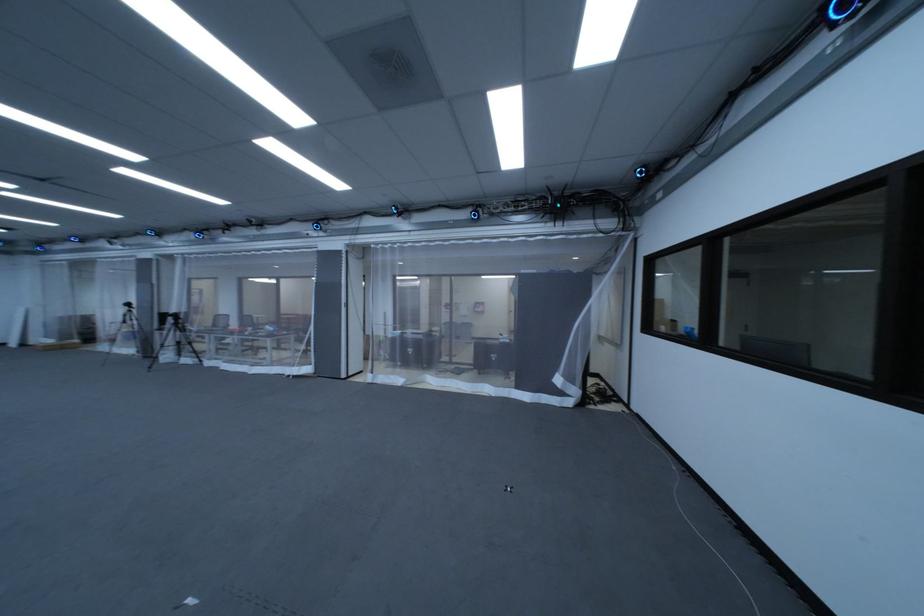
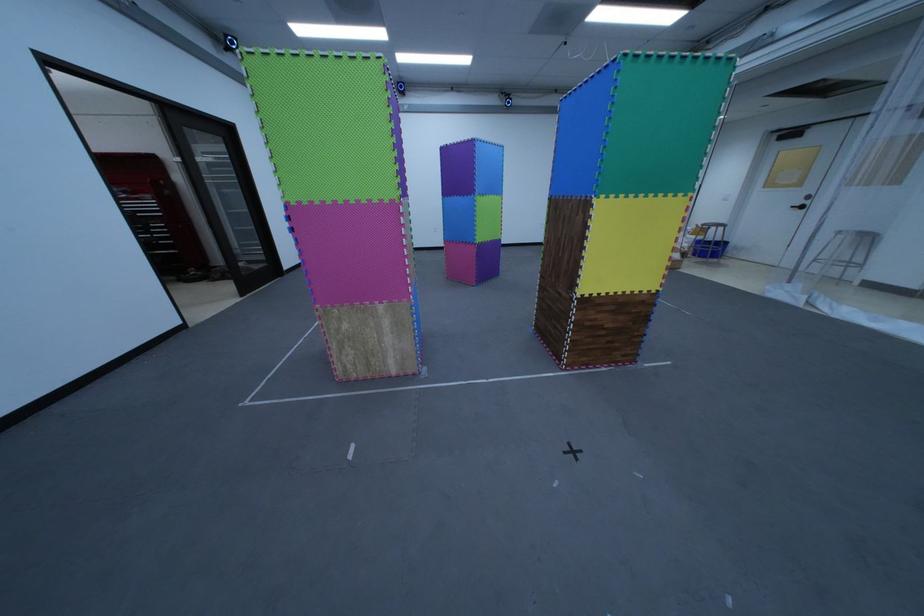
The point at (93,342) is marked in the first image. Where is the corresponding point in the second image?

(691, 257)